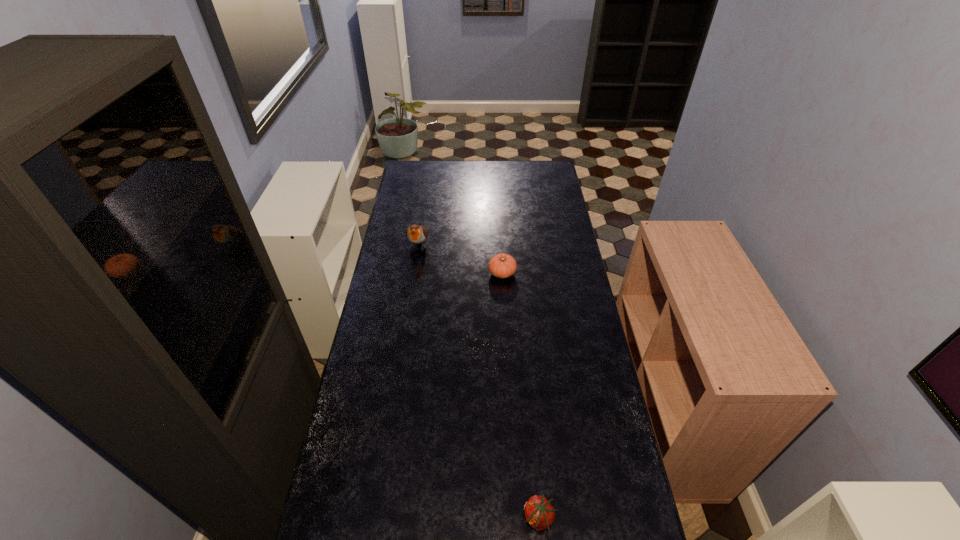
Identify the location of vacant space at the far edge of the desktop. The height and width of the screenshot is (540, 960). (524, 165).

The height and width of the screenshot is (540, 960). In the image, there is a desktop. In order to click on vacant area at the left edge in this screenshot , I will do `click(417, 190)`.

The width and height of the screenshot is (960, 540). In order to click on vacant space at the right edge in this screenshot , I will do `click(579, 279)`.

Identify the location of free point between the tallest object and the taller tomato. The height and width of the screenshot is (540, 960). (461, 259).

You are a GUI agent. You are given a task and a screenshot of the screen. Output one action in this format:
    pyautogui.click(x=<x>, y=<y>)
    Task: Click on the vacant area between the taller tomato and the shorter tomato
    This screenshot has width=960, height=540.
    Given the screenshot: What is the action you would take?
    pyautogui.click(x=520, y=396)

You are a GUI agent. You are given a task and a screenshot of the screen. Output one action in this format:
    pyautogui.click(x=<x>, y=<y>)
    Task: Click on the vacant region between the second farthest object and the shorter tomato
    
    Given the screenshot: What is the action you would take?
    pyautogui.click(x=520, y=396)

Where is `vacant area that lies between the shortest object and the leftmost object`? The width and height of the screenshot is (960, 540). vacant area that lies between the shortest object and the leftmost object is located at coordinates (479, 382).

This screenshot has width=960, height=540. Find the location of `unoccupied position between the farther tomato and the nearest object`. unoccupied position between the farther tomato and the nearest object is located at coordinates (520, 396).

Where is `free area in between the taller tomato and the tallest object`? free area in between the taller tomato and the tallest object is located at coordinates (461, 259).

The width and height of the screenshot is (960, 540). What are the coordinates of `free space between the leftmost object and the second tallest object` in the screenshot? It's located at (461, 259).